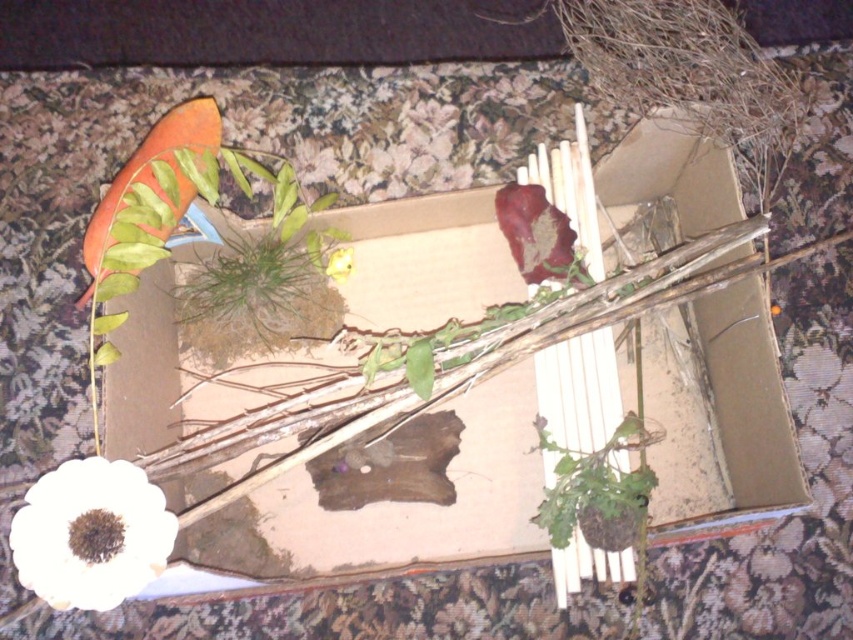
Between green matte plant at lower right and yellow matte flower at center, which one has more height?

green matte plant at lower right

Which is more to the left, green matte plant at lower right or yellow matte flower at center?

From the viewer's perspective, yellow matte flower at center appears more on the left side.

Between point (608, 493) and point (328, 268), which one is positioned in front?

Point (608, 493) is in front.

Identify the location of green matte plant at lower right. (596, 492).

Does brown cardboard box at center have a smaller size compared to green matte plant at lower right?

Incorrect, brown cardboard box at center is not smaller in size than green matte plant at lower right.

Is point (241, 392) farther from viewer compared to point (605, 547)?

That is True.

Find the location of a particular element. This screenshot has height=640, width=853. brown cardboard box at center is located at coordinates (467, 472).

Which is behind, point (653, 195) or point (100, 504)?

Positioned behind is point (653, 195).

Does brown cardboard box at center have a lesser width compared to white matte flower at lower left?

In fact, brown cardboard box at center might be wider than white matte flower at lower left.

Describe the element at coordinates (467, 472) in the screenshot. I see `brown cardboard box at center` at that location.

Locate an element on the screen. Image resolution: width=853 pixels, height=640 pixels. brown cardboard box at center is located at coordinates (467, 472).